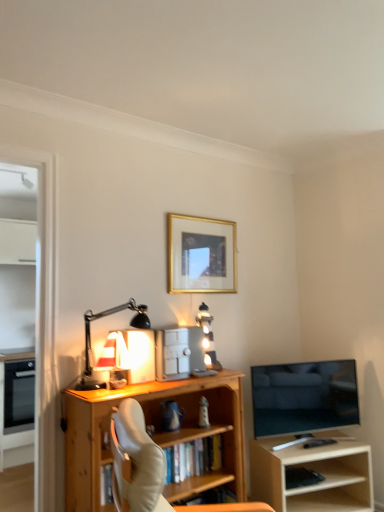
Question: Should I look upward or downward to see gold-framed picture at upper center?

Choices:
 (A) down
 (B) up

Answer: (B)

Question: Considering the relative sizes of gold-framed picture at upper center and flat screen tv at right in the image provided, is gold-framed picture at upper center thinner than flat screen tv at right?

Choices:
 (A) no
 (B) yes

Answer: (B)

Question: Is gold-framed picture at upper center outside flat screen tv at right?

Choices:
 (A) no
 (B) yes

Answer: (B)

Question: From the image's perspective, is gold-framed picture at upper center on top of flat screen tv at right?

Choices:
 (A) yes
 (B) no

Answer: (A)

Question: From the image's perspective, is gold-framed picture at upper center under flat screen tv at right?

Choices:
 (A) yes
 (B) no

Answer: (B)

Question: Is gold-framed picture at upper center positioned before flat screen tv at right?

Choices:
 (A) no
 (B) yes

Answer: (A)

Question: Are gold-framed picture at upper center and flat screen tv at right far apart?

Choices:
 (A) yes
 (B) no

Answer: (B)

Question: Is gold-framed picture at upper center behind black matte desk lamp at left?

Choices:
 (A) no
 (B) yes

Answer: (B)

Question: From a real-world perspective, is gold-framed picture at upper center under black matte desk lamp at left?

Choices:
 (A) yes
 (B) no

Answer: (B)

Question: Is gold-framed picture at upper center turned away from black matte desk lamp at left?

Choices:
 (A) no
 (B) yes

Answer: (A)

Question: Is gold-framed picture at upper center far away from black matte desk lamp at left?

Choices:
 (A) yes
 (B) no

Answer: (B)

Question: Can we say gold-framed picture at upper center lies outside black matte desk lamp at left?

Choices:
 (A) no
 (B) yes

Answer: (B)

Question: Can you confirm if gold-framed picture at upper center is positioned to the left of black matte desk lamp at left?

Choices:
 (A) no
 (B) yes

Answer: (A)

Question: Would you consider black matte desk lamp at left to be distant from light wood shelf at right?

Choices:
 (A) yes
 (B) no

Answer: (A)